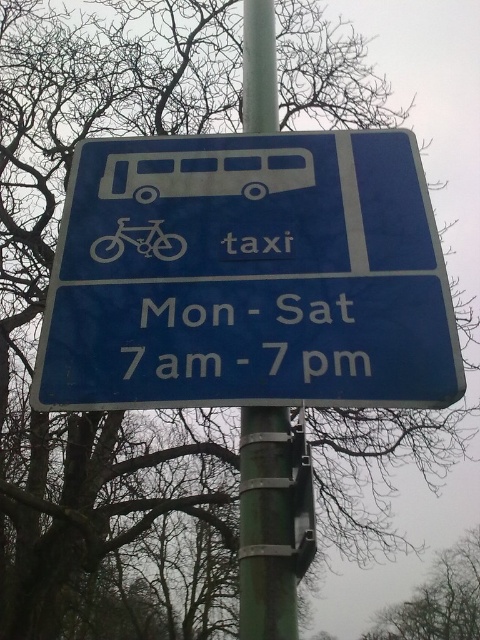
From the picture: You are standing in front of the blue plastic sign at center and the green metallic pole at center. Which object is positioned to the left?

The blue plastic sign at center is to the left of the green metallic pole at center.

You are a pedestrian trying to read the information on the blue plastic sign at center and the white text at center. Which one is placed higher up?

The blue plastic sign at center is positioned over the white text at center, so the blue plastic sign at center is higher up.

You are a city planner reviewing the placement of the blue road sign. You need to ensure that the white text at center and the matte silver bicycle at center are spaced at least 8 inches apart for readability. Does the current spacing meet the requirement?

The white text at center and matte silver bicycle at center are 8.80 inches apart, which exceeds the minimum requirement of 8 inches, so the spacing is sufficient for readability.